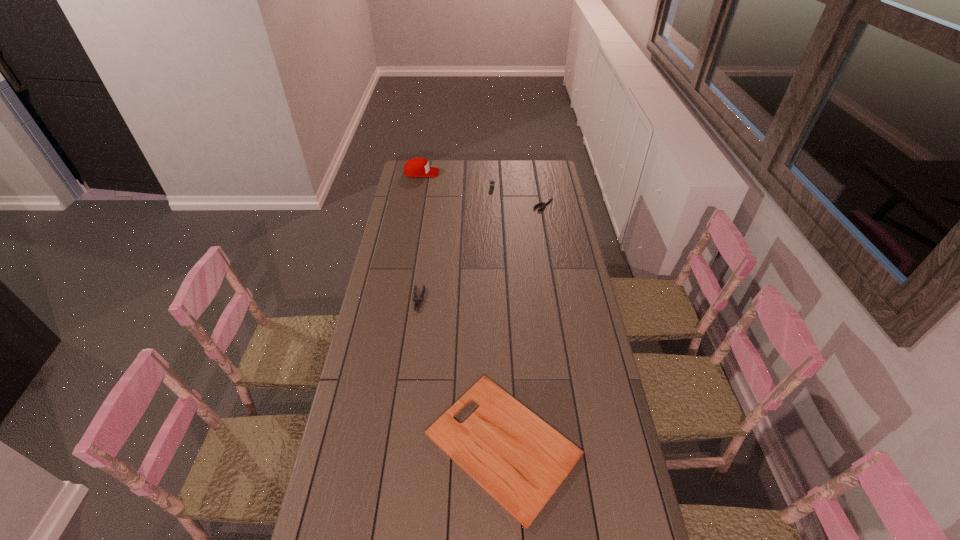
Where is `free space located on the front of the second tallest object`? The width and height of the screenshot is (960, 540). free space located on the front of the second tallest object is located at coordinates (493, 215).

Identify the location of free spot located 0.290m at the gripping part of the second nearest object. Image resolution: width=960 pixels, height=540 pixels. (408, 374).

Where is `vacant space located 0.080m on the left of the nearest object`? vacant space located 0.080m on the left of the nearest object is located at coordinates (398, 444).

Find the location of a particular element. vacant space situated 0.400m on the left of the third nearest object is located at coordinates (456, 205).

Find the location of `object present at the far edge`. object present at the far edge is located at coordinates (416, 167).

In order to click on object that is positioned at the left edge in this screenshot , I will do `click(416, 167)`.

I want to click on chopping board located in the right edge section of the desktop, so click(x=517, y=458).

The image size is (960, 540). Find the location of `pliers at the right edge`. pliers at the right edge is located at coordinates (548, 200).

Find the location of a particular element. The image size is (960, 540). object positioned at the far left corner is located at coordinates (416, 167).

Locate an element on the screen. free region at the far edge of the desktop is located at coordinates [466, 164].